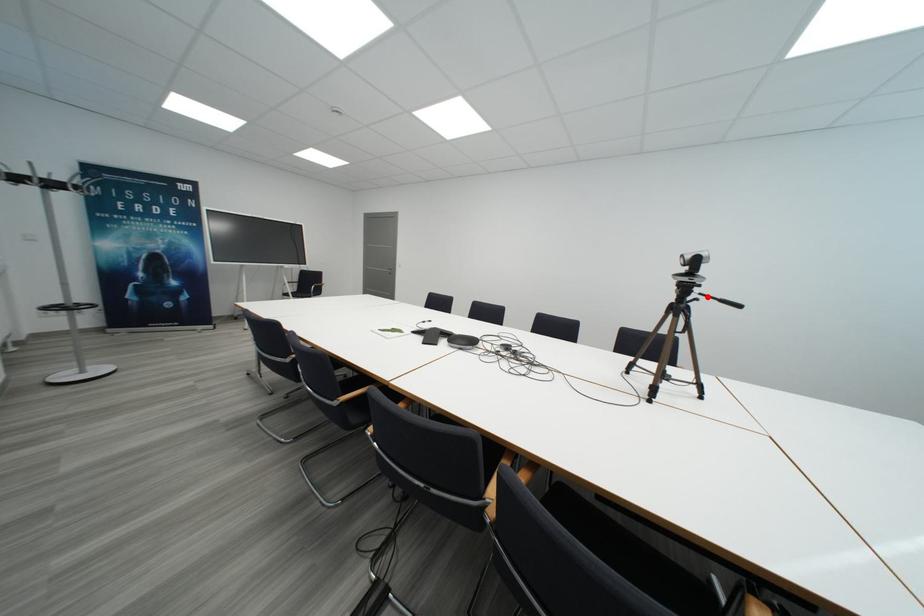
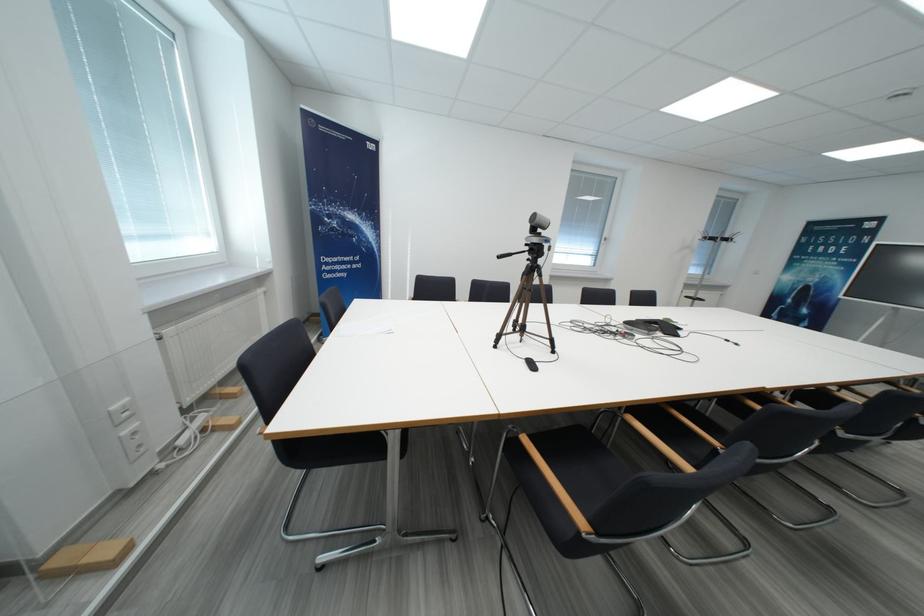
The point at the highlighted location is marked in the first image. Where is the corresponding point in the second image?

(531, 254)